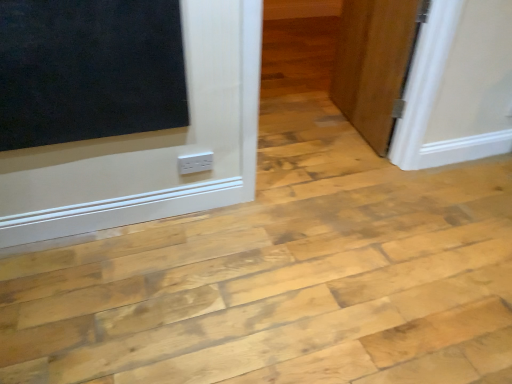
Identify the location of vacant space underneath wooden door at right (from a real-world perspective). tap(344, 122).